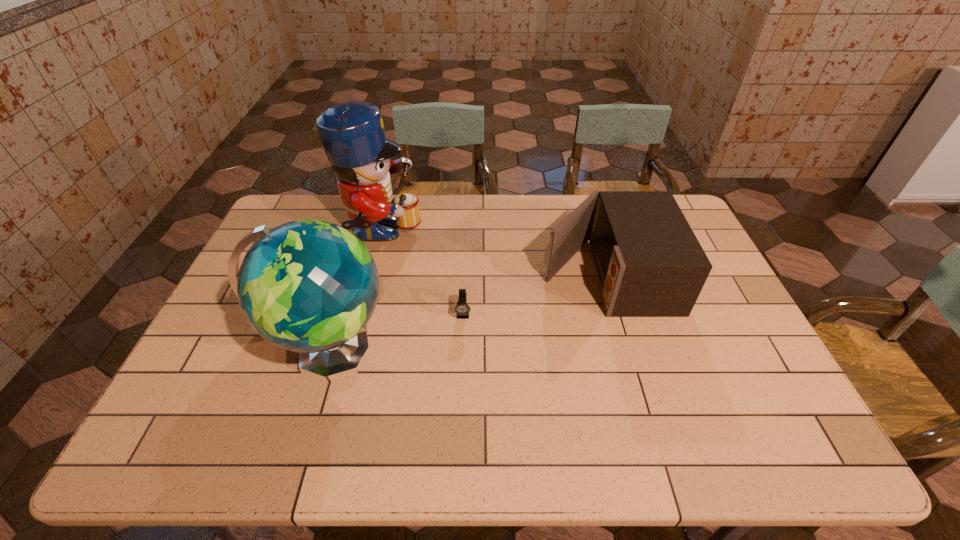
Where is `nutcracker`? The image size is (960, 540). nutcracker is located at coordinates (352, 133).

You are a GUI agent. You are given a task and a screenshot of the screen. Output one action in this format:
    pyautogui.click(x=<x>, y=<y>)
    Task: Click on the globe
    This screenshot has height=540, width=960.
    Given the screenshot: What is the action you would take?
    pyautogui.click(x=309, y=286)

Where is `microwave oven`? Image resolution: width=960 pixels, height=540 pixels. microwave oven is located at coordinates coord(650,263).

Locate an element on the screen. the rightmost object is located at coordinates (650, 263).

At what (x,y) coordinates should I click in order to perform the action: click on watch. Please return your answer as a coordinate pair (x, y). Looking at the image, I should click on pos(462,309).

Locate an element on the screen. the third object from left to right is located at coordinates (462, 309).

This screenshot has height=540, width=960. What are the coordinates of `vacant area situated 0.310m on the front-facing side of the nutcracker` in the screenshot? It's located at (511, 235).

Image resolution: width=960 pixels, height=540 pixels. What are the coordinates of `vacant area located on the front surface of the globe` in the screenshot? It's located at (x=426, y=353).

Where is `free space located with the door open on the front of the third tallest object`? The width and height of the screenshot is (960, 540). free space located with the door open on the front of the third tallest object is located at coordinates (420, 275).

The image size is (960, 540). I want to click on free space located with the door open on the front of the third tallest object, so click(439, 275).